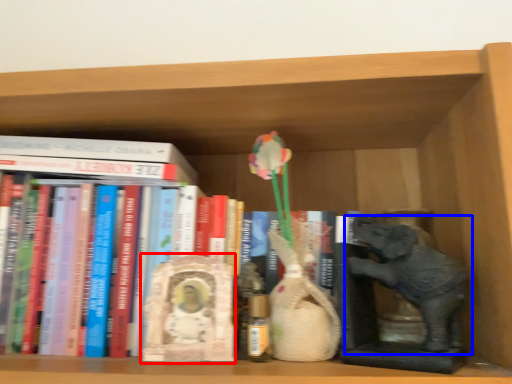
Question: Which object appears farthest to the camera in this image, sculpture (highlighted by a red box) or elephant (highlighted by a blue box)?

Choices:
 (A) sculpture
 (B) elephant

Answer: (A)